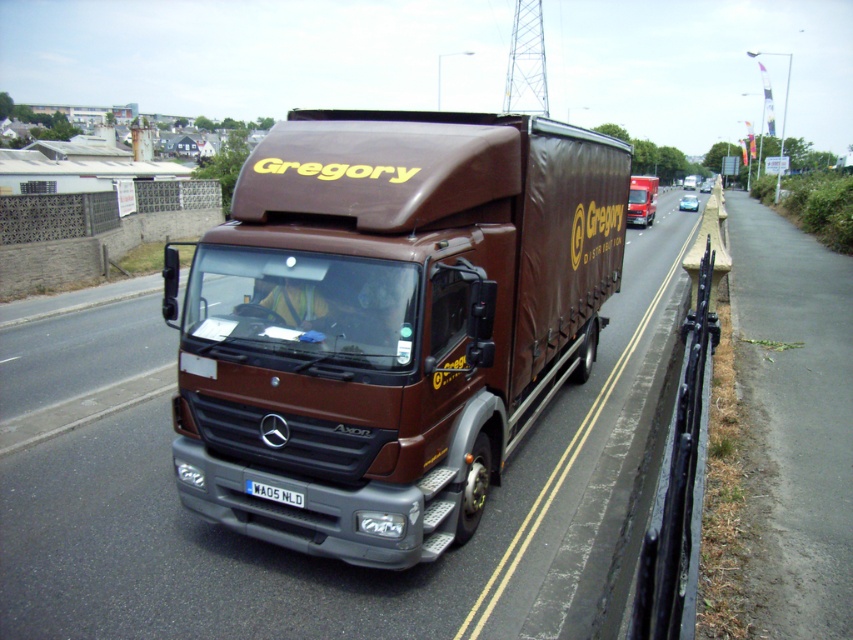
You are a photographer trying to capture a clear shot of the brown matte truck at center and the white plastic license plate at center. Since the truck is bigger than the license plate, which object should you focus on first to ensure both are in frame?

The brown matte truck at center is bigger than the white plastic license plate at center, so you should focus on the brown matte truck at center first to ensure it fits in the frame, then adjust to include the smaller license plate.

You are a delivery driver who needs to park the brown matte truck at center and the white plastic license plate at center in a narrow parking spot. Which object should you park first to ensure both fit?

The brown matte truck at center is wider than the white plastic license plate at center, so you should park the brown matte truck at center first to accommodate its width before fitting the smaller license plate.